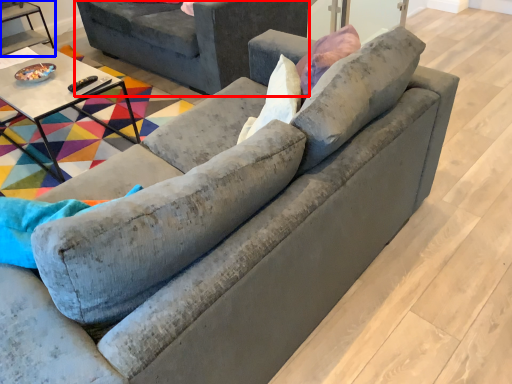
Question: Among these objects, which one is nearest to the camera, studio couch (highlighted by a red box) or table (highlighted by a blue box)?

Choices:
 (A) studio couch
 (B) table

Answer: (A)